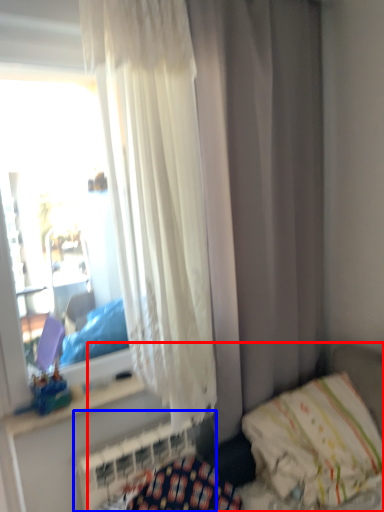
Question: Which object appears farthest to the camera in this image, hospital bed (highlighted by a red box) or radiator (highlighted by a blue box)?

Choices:
 (A) hospital bed
 (B) radiator

Answer: (B)